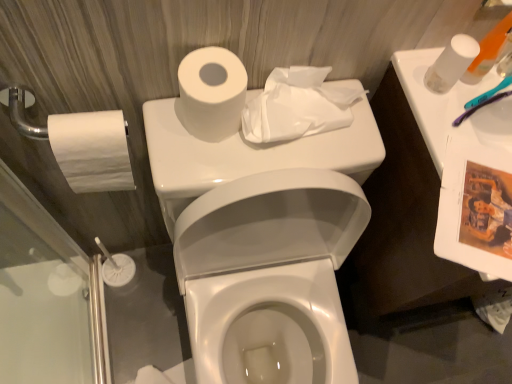
Locate an element on the screen. free location in front of white plastic toothbrush at upper right, positioned as the first toiletry in left-to-right order is located at coordinates (462, 148).